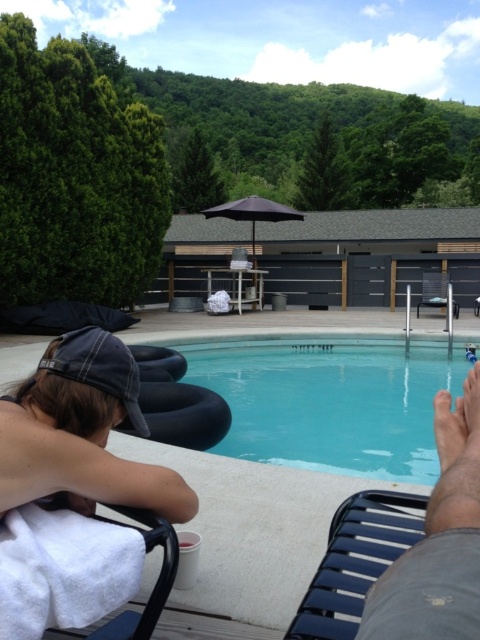
Based on the photo, you are standing at the point labeled point (x=140, y=616) and want to walk to the point labeled point (x=320, y=604). Which direction should you face to walk directly towards your destination?

You should face north because point (x=320, y=604) is in front of point (x=140, y=616), indicating it is north of your current position.